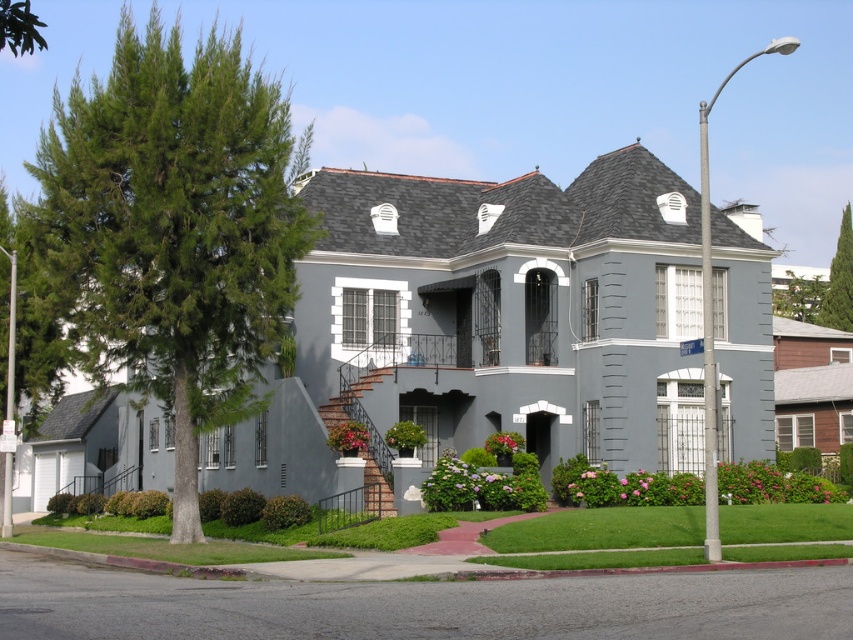
Question: Is green leafy tree at upper right positioned before green leafy tree at upper left?

Choices:
 (A) yes
 (B) no

Answer: (B)

Question: Estimate the real-world distances between objects in this image. Which object is farther from the green leafy tree at upper left?

Choices:
 (A) green needle-like leaves at left
 (B) green leafy tree at upper right

Answer: (B)

Question: Can you confirm if green leafy tree at upper right is smaller than green leafy tree at upper left?

Choices:
 (A) yes
 (B) no

Answer: (A)

Question: Can you confirm if green needle-like leaves at left is thinner than green leafy tree at upper left?

Choices:
 (A) no
 (B) yes

Answer: (B)

Question: Considering the real-world distances, which object is farthest from the green needle-like leaves at left?

Choices:
 (A) green leafy tree at upper right
 (B) green leafy tree at upper left

Answer: (A)

Question: Based on their relative distances, which object is nearer to the green leafy tree at upper left?

Choices:
 (A) green needle-like leaves at left
 (B) green leafy tree at upper right

Answer: (A)